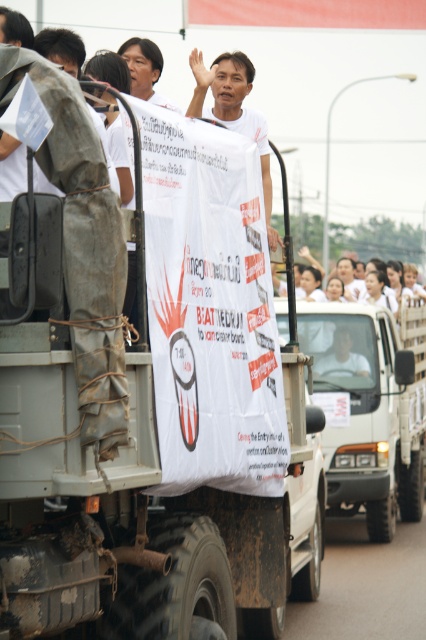
Question: Which point appears closest to the camera in this image?

Choices:
 (A) click(219, 77)
 (B) click(363, 401)

Answer: (A)

Question: Can you confirm if white matte truck at center is bigger than rusty metal suit at left?

Choices:
 (A) yes
 (B) no

Answer: (A)

Question: Which point is farther to the camera?

Choices:
 (A) [x=118, y=385]
 (B) [x=377, y=336]

Answer: (B)

Question: Does white matte truck at center have a larger size compared to rusty metal suit at left?

Choices:
 (A) no
 (B) yes

Answer: (B)

Question: Which point appears closest to the camera in this image?

Choices:
 (A) (333, 467)
 (B) (97, 314)

Answer: (B)

Question: Does white matte truck at center appear on the right side of rusty metal suit at left?

Choices:
 (A) no
 (B) yes

Answer: (B)